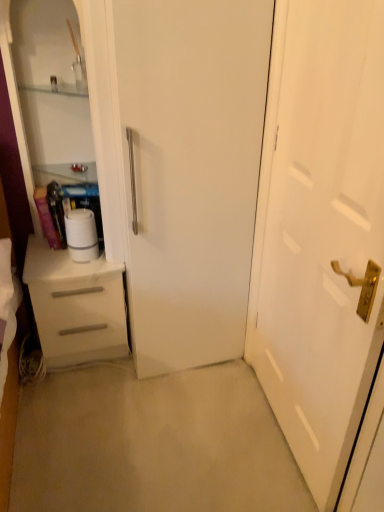
Question: Does white glossy door at center have a lesser height compared to white matte drawer at left?

Choices:
 (A) yes
 (B) no

Answer: (B)

Question: Is white glossy door at center beside white matte drawer at left?

Choices:
 (A) yes
 (B) no

Answer: (B)

Question: From the image's perspective, is white glossy door at center located above white matte drawer at left?

Choices:
 (A) yes
 (B) no

Answer: (A)

Question: From a real-world perspective, does white glossy door at center sit lower than white matte drawer at left?

Choices:
 (A) no
 (B) yes

Answer: (A)

Question: Is white glossy door at center located outside white matte drawer at left?

Choices:
 (A) yes
 (B) no

Answer: (A)

Question: Can you confirm if white glossy door at center is positioned to the right of white matte drawer at left?

Choices:
 (A) no
 (B) yes

Answer: (B)

Question: Is white matte drawer at left positioned with its back to white glossy dresser at left?

Choices:
 (A) yes
 (B) no

Answer: (B)

Question: Are white matte drawer at left and white glossy dresser at left far apart?

Choices:
 (A) no
 (B) yes

Answer: (A)

Question: Is white matte drawer at left aimed at white glossy dresser at left?

Choices:
 (A) yes
 (B) no

Answer: (B)

Question: Does white matte drawer at left have a larger size compared to white glossy dresser at left?

Choices:
 (A) yes
 (B) no

Answer: (B)

Question: Would you say white matte drawer at left is outside white glossy dresser at left?

Choices:
 (A) yes
 (B) no

Answer: (A)

Question: Is white matte drawer at left smaller than white glossy dresser at left?

Choices:
 (A) no
 (B) yes

Answer: (B)

Question: From the image's perspective, is white matte paper towel at left above white glossy dresser at left?

Choices:
 (A) no
 (B) yes

Answer: (A)